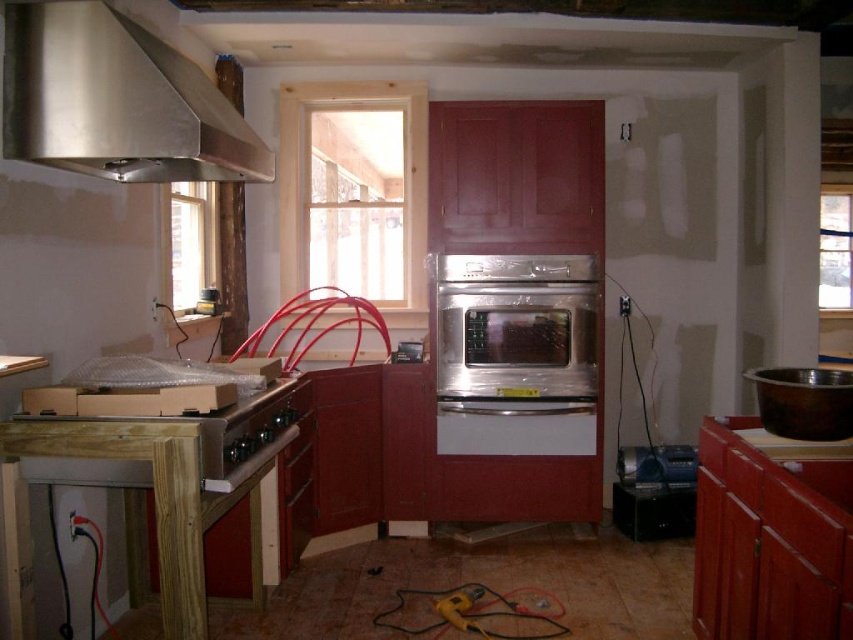
Is point (212, 156) more distant than point (573, 436)?

That is False.

Can you confirm if stainless steel exhaust hood at upper left is shorter than satin stainless steel oven at center?

Yes, stainless steel exhaust hood at upper left is shorter than satin stainless steel oven at center.

At what (x,y) coordinates should I click in order to perform the action: click on stainless steel exhaust hood at upper left. Please return your answer as a coordinate pair (x, y). The height and width of the screenshot is (640, 853). Looking at the image, I should click on (115, 100).

Consider the image. How far apart are stainless steel exhaust hood at upper left and stainless steel sink at right?

They are 6.68 feet apart.

Is point (193, 122) behind point (763, 392)?

No, (193, 122) is in front of (763, 392).

Identify the location of stainless steel exhaust hood at upper left. Image resolution: width=853 pixels, height=640 pixels. (115, 100).

Is satin stainless steel oven at center further to camera compared to wooden at center?

Yes.

Find the location of `satin stainless steel oven at center`. satin stainless steel oven at center is located at coordinates (515, 355).